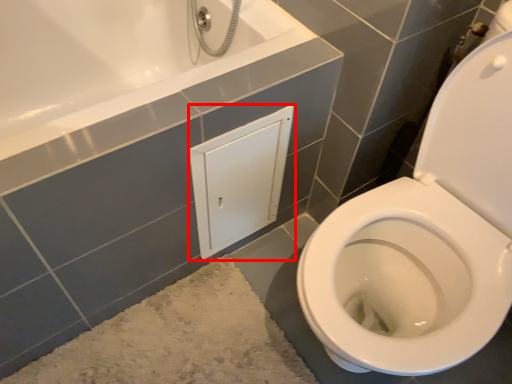
Question: Considering the relative positions of medicine cabinet (annotated by the red box) and bath mat in the image provided, where is medicine cabinet (annotated by the red box) located with respect to the staircase?

Choices:
 (A) right
 (B) left

Answer: (A)